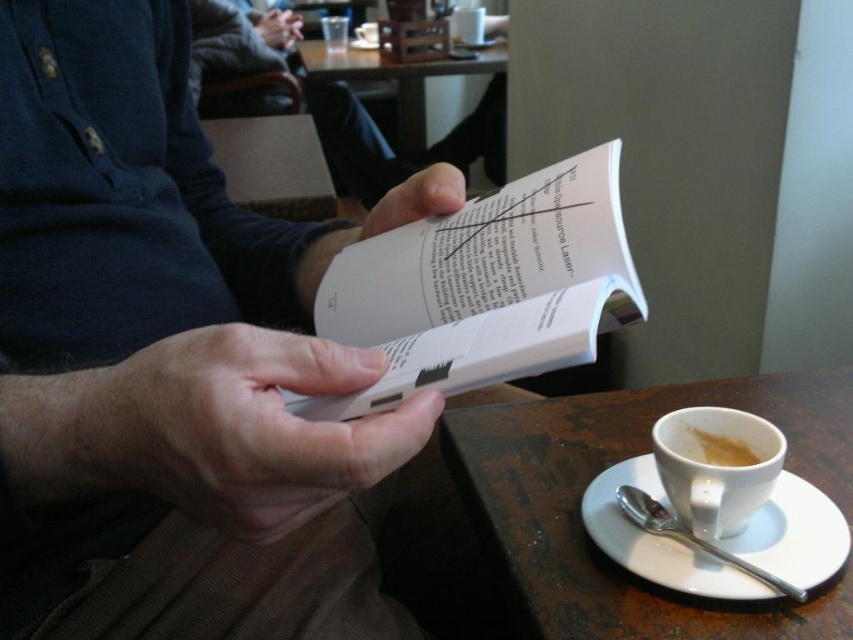
You are a barista who needs to place the white matte cup at lower right on the table without disturbing the book titled Open Source LaTeX. What is the minimum distance you should maintain between the cup and the book to ensure there is enough space for both items?

The minimum distance you should maintain between the white matte cup at lower right and the book is 18.45 inches to ensure there is enough space for both items.

You are standing 10 inches away from the point at coordinates point [234,346]. Can you reach it without moving your feet?

The point [234,346] is 12.85 inches away from you, so you cannot reach it without moving your feet since you are only 10 inches away from it.

What is located at the coordinates point (416, 198) in the image?

The point (416, 198) corresponds to white paper at center.